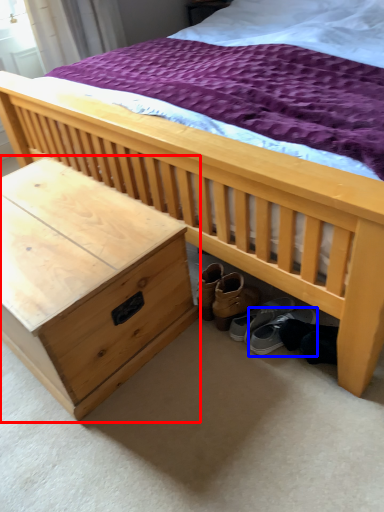
Question: Which object is closer to the camera taking this photo, nightstand (highlighted by a red box) or footwear (highlighted by a blue box)?

Choices:
 (A) nightstand
 (B) footwear

Answer: (A)